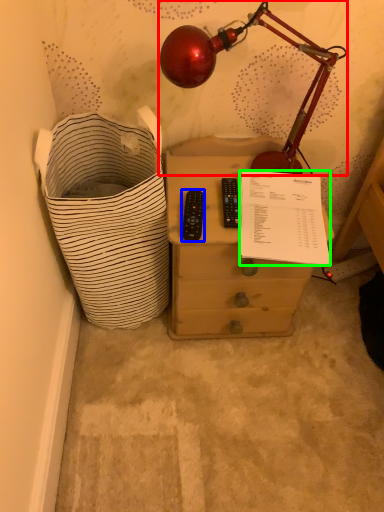
Question: Which object is positioned closest to lamp (highlighted by a red box)? Select from control (highlighted by a blue box) and writing (highlighted by a green box).

Choices:
 (A) control
 (B) writing

Answer: (B)